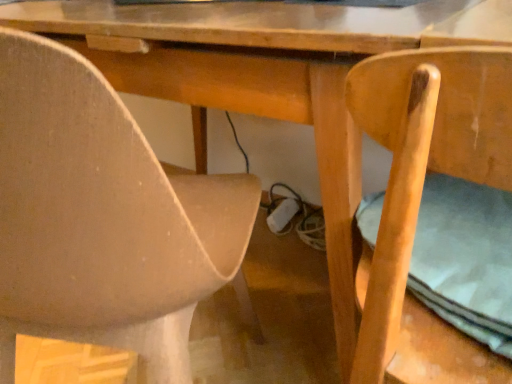
What do you see at coordinates (421, 195) in the screenshot? The image size is (512, 384). I see `light brown wood chair at right, the second chair in the left-to-right sequence` at bounding box center [421, 195].

Locate an element on the screen. The image size is (512, 384). light brown wood chair at right, the second chair in the left-to-right sequence is located at coordinates (421, 195).

Locate an element on the screen. This screenshot has width=512, height=384. matte beige chair at lower left, which is the 2th chair from right to left is located at coordinates (103, 218).

This screenshot has height=384, width=512. What do you see at coordinates (103, 218) in the screenshot? I see `matte beige chair at lower left, which is the 2th chair from right to left` at bounding box center [103, 218].

I want to click on light brown wood chair at right, the second chair in the left-to-right sequence, so click(421, 195).

Visually, is light brown wood chair at right, the second chair in the left-to-right sequence, positioned to the left or to the right of matte beige chair at lower left, acting as the first chair starting from the left?

From the image, it's evident that light brown wood chair at right, the second chair in the left-to-right sequence, is to the right of matte beige chair at lower left, acting as the first chair starting from the left.

Is light brown wood chair at right, which is the 1th chair in right-to-left order, in front of or behind matte beige chair at lower left, acting as the first chair starting from the left, in the image?

light brown wood chair at right, which is the 1th chair in right-to-left order, is positioned closer to the viewer than matte beige chair at lower left, acting as the first chair starting from the left.

Which is less distant, [417,159] or [29,75]?

Clearly, point [417,159] is more distant from the camera than point [29,75].

From the image's perspective, who appears lower, light brown wood chair at right, the second chair in the left-to-right sequence, or matte beige chair at lower left, which is the 2th chair from right to left?

light brown wood chair at right, the second chair in the left-to-right sequence, from the image's perspective.

From a real-world perspective, is light brown wood chair at right, which is the 1th chair in right-to-left order, positioned above or below matte beige chair at lower left, acting as the first chair starting from the left?

From a real-world perspective, light brown wood chair at right, which is the 1th chair in right-to-left order, is physically below matte beige chair at lower left, acting as the first chair starting from the left.

Considering the relative sizes of light brown wood chair at right, the second chair in the left-to-right sequence, and matte beige chair at lower left, acting as the first chair starting from the left, in the image provided, is light brown wood chair at right, the second chair in the left-to-right sequence, thinner than matte beige chair at lower left, acting as the first chair starting from the left,?

Indeed, light brown wood chair at right, the second chair in the left-to-right sequence, has a lesser width compared to matte beige chair at lower left, acting as the first chair starting from the left.

In terms of height, does light brown wood chair at right, which is the 1th chair in right-to-left order, look taller or shorter compared to matte beige chair at lower left, which is the 2th chair from right to left?

In the image, light brown wood chair at right, which is the 1th chair in right-to-left order, appears to be shorter than matte beige chair at lower left, which is the 2th chair from right to left.

Is light brown wood chair at right, the second chair in the left-to-right sequence, bigger than matte beige chair at lower left, which is the 2th chair from right to left?

No.

Is light brown wood chair at right, the second chair in the left-to-right sequence, not inside matte beige chair at lower left, which is the 2th chair from right to left?

Yes, light brown wood chair at right, the second chair in the left-to-right sequence, is located beyond the bounds of matte beige chair at lower left, which is the 2th chair from right to left.

Are light brown wood chair at right, which is the 1th chair in right-to-left order, and matte beige chair at lower left, acting as the first chair starting from the left, far apart?

That's not correct — light brown wood chair at right, which is the 1th chair in right-to-left order, is a little close to matte beige chair at lower left, acting as the first chair starting from the left.

Is light brown wood chair at right, which is the 1th chair in right-to-left order, oriented towards matte beige chair at lower left, which is the 2th chair from right to left?

No, light brown wood chair at right, which is the 1th chair in right-to-left order, does not turn towards matte beige chair at lower left, which is the 2th chair from right to left.

How different are the orientations of light brown wood chair at right, the second chair in the left-to-right sequence, and matte beige chair at lower left, which is the 2th chair from right to left, in degrees?

light brown wood chair at right, the second chair in the left-to-right sequence, and matte beige chair at lower left, which is the 2th chair from right to left, are facing 15.5 degrees away from each other.

In the scene shown: Measure the distance between light brown wood chair at right, the second chair in the left-to-right sequence, and matte beige chair at lower left, which is the 2th chair from right to left.

10.82 inches.

Where is `chair on the left of light brown wood chair at right, the second chair in the left-to-right sequence`? This screenshot has height=384, width=512. chair on the left of light brown wood chair at right, the second chair in the left-to-right sequence is located at coordinates (103, 218).

Which object is positioned more to the left, matte beige chair at lower left, which is the 2th chair from right to left, or light brown wood chair at right, which is the 1th chair in right-to-left order?

matte beige chair at lower left, which is the 2th chair from right to left.

Is matte beige chair at lower left, which is the 2th chair from right to left, behind light brown wood chair at right, which is the 1th chair in right-to-left order?

That is True.

Is point (61, 49) behind point (446, 144)?

Yes.

From the image's perspective, which object appears higher, matte beige chair at lower left, which is the 2th chair from right to left, or light brown wood chair at right, the second chair in the left-to-right sequence?

matte beige chair at lower left, which is the 2th chair from right to left, appears higher in the image.

From a real-world perspective, which is physically above, matte beige chair at lower left, acting as the first chair starting from the left, or light brown wood chair at right, the second chair in the left-to-right sequence?

matte beige chair at lower left, acting as the first chair starting from the left, from a real-world perspective.

Looking at this image, considering the sizes of matte beige chair at lower left, acting as the first chair starting from the left, and light brown wood chair at right, the second chair in the left-to-right sequence, in the image, is matte beige chair at lower left, acting as the first chair starting from the left, wider or thinner than light brown wood chair at right, the second chair in the left-to-right sequence,?

Clearly, matte beige chair at lower left, acting as the first chair starting from the left, has more width compared to light brown wood chair at right, the second chair in the left-to-right sequence.

Who is shorter, matte beige chair at lower left, which is the 2th chair from right to left, or light brown wood chair at right, which is the 1th chair in right-to-left order?

light brown wood chair at right, which is the 1th chair in right-to-left order.

Consider the image. Does matte beige chair at lower left, acting as the first chair starting from the left, have a smaller size compared to light brown wood chair at right, which is the 1th chair in right-to-left order?

Incorrect, matte beige chair at lower left, acting as the first chair starting from the left, is not smaller in size than light brown wood chair at right, which is the 1th chair in right-to-left order.

Is matte beige chair at lower left, which is the 2th chair from right to left, completely or partially outside of light brown wood chair at right, the second chair in the left-to-right sequence?

Yes, matte beige chair at lower left, which is the 2th chair from right to left, is not within light brown wood chair at right, the second chair in the left-to-right sequence.

Is matte beige chair at lower left, which is the 2th chair from right to left, not close to light brown wood chair at right, the second chair in the left-to-right sequence?

No, matte beige chair at lower left, which is the 2th chair from right to left, is not far away from light brown wood chair at right, the second chair in the left-to-right sequence.

Is light brown wood chair at right, the second chair in the left-to-right sequence, at the back of matte beige chair at lower left, which is the 2th chair from right to left?

No, matte beige chair at lower left, which is the 2th chair from right to left, is not facing the opposite direction of light brown wood chair at right, the second chair in the left-to-right sequence.

Where is `chair lying above the light brown wood chair at right, which is the 1th chair in right-to-left order (from the image's perspective)`? chair lying above the light brown wood chair at right, which is the 1th chair in right-to-left order (from the image's perspective) is located at coordinates (103, 218).

What are the coordinates of `chair above the light brown wood chair at right, the second chair in the left-to-right sequence (from a real-world perspective)` in the screenshot? It's located at (103, 218).

Where is `chair beneath the matte beige chair at lower left, acting as the first chair starting from the left (from a real-world perspective)`? This screenshot has width=512, height=384. chair beneath the matte beige chair at lower left, acting as the first chair starting from the left (from a real-world perspective) is located at coordinates 421,195.